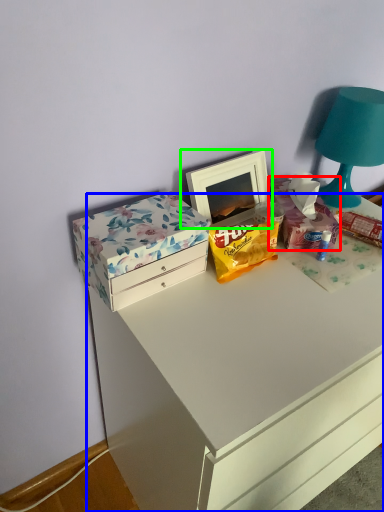
Question: Based on their relative distances, which object is nearer to storage box (highlighted by a red box)? Choose from chest of drawers (highlighted by a blue box) and picture frame (highlighted by a green box).

Choices:
 (A) chest of drawers
 (B) picture frame

Answer: (B)